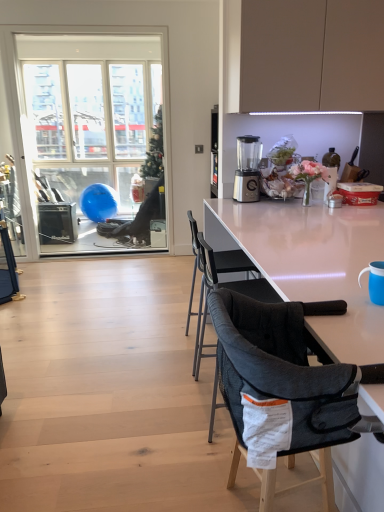
Identify the location of free space in front of dark gray fabric chair at center, placed as the second chair when sorted from front to back. click(x=178, y=390).